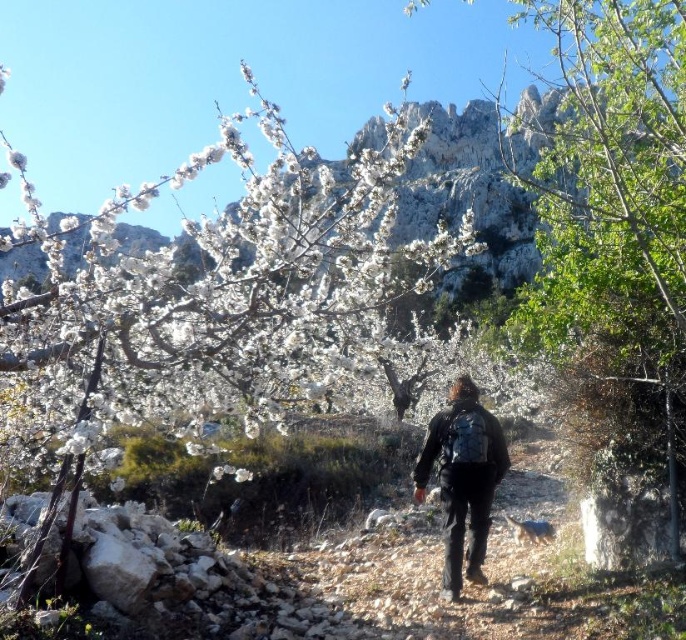
You are a hiker who wants to take a photo of the white fluffy blossoms at upper left and the black matte backpack at center. Which object should you focus on first if you want to capture both in the same frame without moving your camera?

You should focus on the white fluffy blossoms at upper left first because it is positioned on the left side of the black matte backpack at center, so keeping both in frame requires starting with the leftmost object.

You are standing at the point with coordinates point (272, 209) and want to walk towards point (477, 417). Since both points are on the same path, will you be moving towards or away from the viewer as you walk?

Since point (272, 209) is further to the viewer than point (477, 417), walking from point (272, 209) towards point (477, 417) means you are moving away from the viewer.